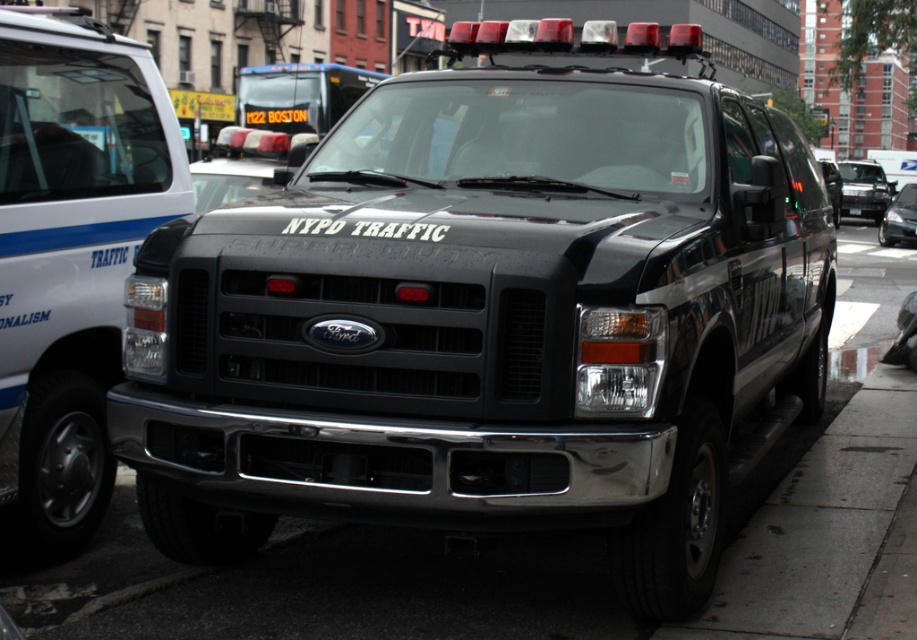
Does white glossy van at left appear on the right side of black plastic license plate at center?

In fact, white glossy van at left is to the left of black plastic license plate at center.

Who is positioned more to the left, white glossy van at left or black plastic license plate at center?

From the viewer's perspective, white glossy van at left appears more on the left side.

What do you see at coordinates (72, 253) in the screenshot?
I see `white glossy van at left` at bounding box center [72, 253].

Locate an element on the screen. The height and width of the screenshot is (640, 917). white glossy van at left is located at coordinates (72, 253).

How distant is black glossy suv at center from shiny black sedan at center?

The distance of black glossy suv at center from shiny black sedan at center is 8.93 meters.

Does black glossy suv at center appear under shiny black sedan at center?

No, black glossy suv at center is not below shiny black sedan at center.

Find the location of a particular element. Image resolution: width=917 pixels, height=640 pixels. black glossy suv at center is located at coordinates (864, 188).

You are a GUI agent. You are given a task and a screenshot of the screen. Output one action in this format:
    pyautogui.click(x=<x>, y=<y>)
    Task: Click on the black glossy suv at center
    The height and width of the screenshot is (640, 917).
    Given the screenshot: What is the action you would take?
    pyautogui.click(x=864, y=188)

Does white glossy van at left appear on the right side of black glossy suv at center?

In fact, white glossy van at left is to the left of black glossy suv at center.

Does white glossy van at left have a smaller size compared to black glossy suv at center?

Indeed, white glossy van at left has a smaller size compared to black glossy suv at center.

Is point (95, 256) in front of point (847, 164)?

Yes, point (95, 256) is closer to viewer.

Locate an element on the screen. This screenshot has height=640, width=917. white glossy van at left is located at coordinates pos(72,253).